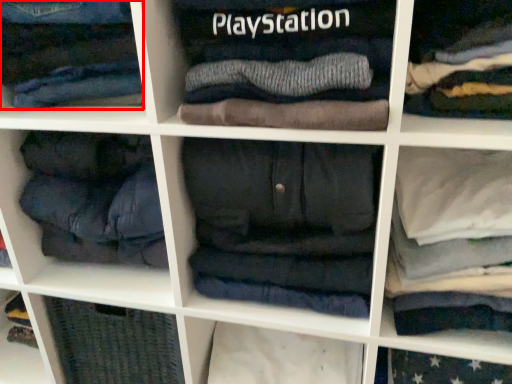
Question: From the image's perspective, where is clothing (annotated by the red box) located relative to clothing?

Choices:
 (A) below
 (B) above

Answer: (B)